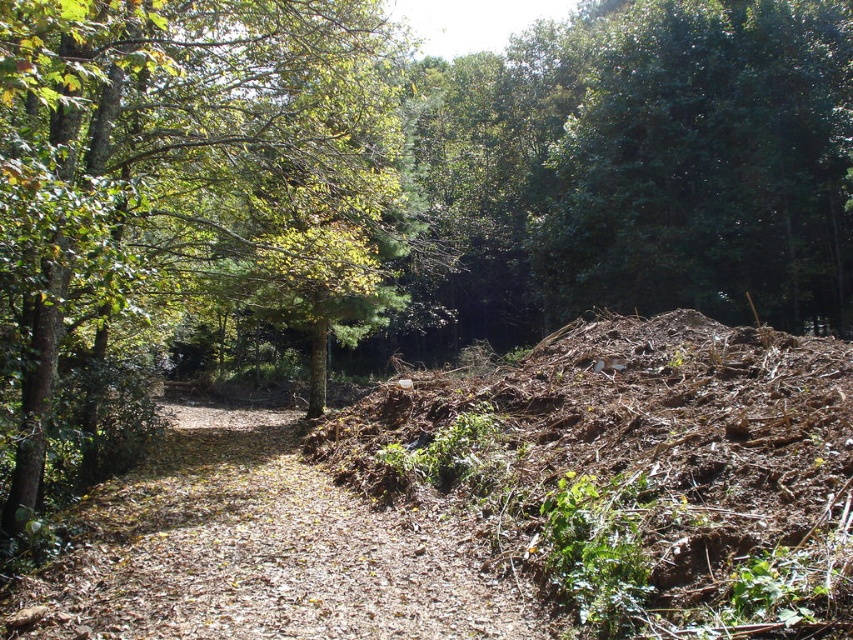
Does brown/dry soil at center have a lesser height compared to brown dirt track at center?

No, brown/dry soil at center is not shorter than brown dirt track at center.

Based on the photo, is brown/dry soil at center smaller than brown dirt track at center?

Actually, brown/dry soil at center might be larger than brown dirt track at center.

Measure the distance between brown/dry soil at center and camera.

A distance of 4.75 meters exists between brown/dry soil at center and camera.

Find the location of a particular element. brown/dry soil at center is located at coordinates (640, 470).

Does green leafy tree at center appear on the right side of brown dirt track at center?

No, green leafy tree at center is not to the right of brown dirt track at center.

Which is more to the left, green leafy tree at center or brown dirt track at center?

green leafy tree at center is more to the left.

Is point (387, 186) positioned in front of point (242, 544)?

No, it is behind (242, 544).

Identify the location of green leafy tree at center. Image resolution: width=853 pixels, height=640 pixels. (177, 209).

Can you confirm if green leafy tree at center is positioned to the right of brown/dry soil at center?

In fact, green leafy tree at center is to the left of brown/dry soil at center.

Is green leafy tree at center below brown/dry soil at center?

Incorrect, green leafy tree at center is not positioned below brown/dry soil at center.

Does point (154, 12) come in front of point (670, 428)?

Yes, it is.

Find the location of a particular element. The width and height of the screenshot is (853, 640). green leafy tree at center is located at coordinates (177, 209).